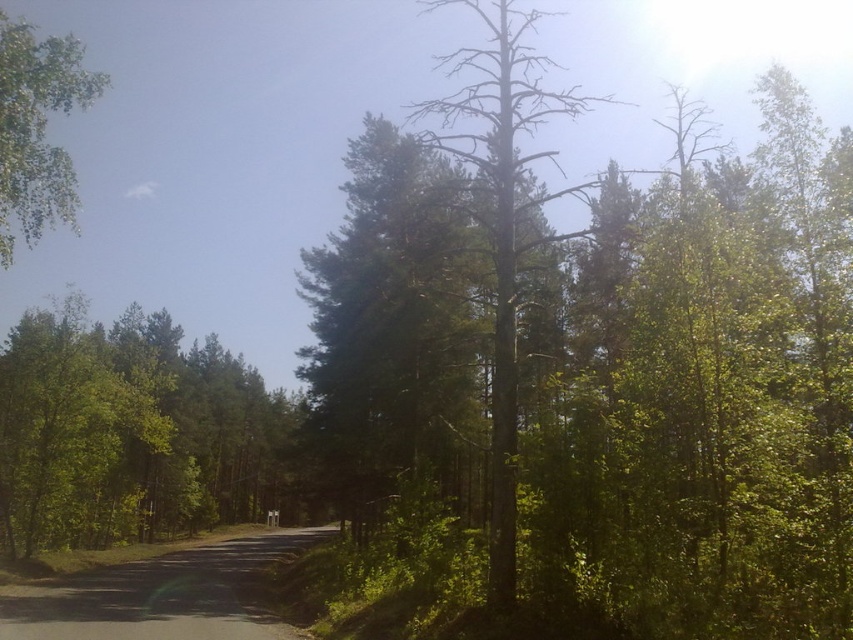
Question: Which of the following is the closest to the observer?

Choices:
 (A) green leafy tree at center
 (B) green leafy tree at upper left

Answer: (B)

Question: Is brown bark tree at center wider than green leafy tree at upper left?

Choices:
 (A) yes
 (B) no

Answer: (B)

Question: Which of these objects is positioned farthest from the brown bark tree at center?

Choices:
 (A) green leafy tree at center
 (B) green leafy tree at upper left

Answer: (B)

Question: Which is nearer to the brown bark tree at center?

Choices:
 (A) green leafy tree at center
 (B) green leafy tree at upper left

Answer: (A)

Question: Does brown bark tree at center have a smaller size compared to green leafy tree at upper left?

Choices:
 (A) yes
 (B) no

Answer: (A)

Question: Does green leafy tree at center appear on the left side of green leafy tree at upper left?

Choices:
 (A) no
 (B) yes

Answer: (A)